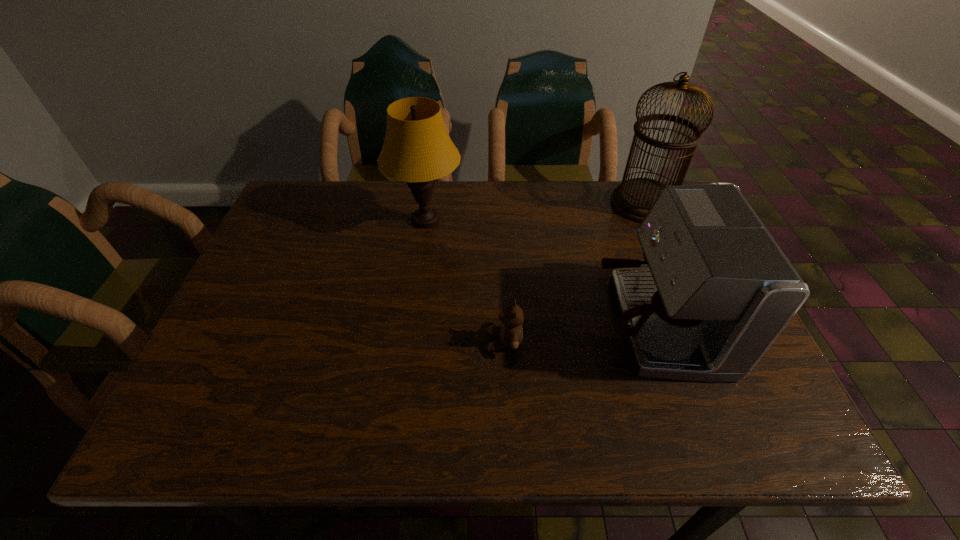
Where is `free space located 0.080m on the front of the second shortest object near the spout`? This screenshot has width=960, height=540. free space located 0.080m on the front of the second shortest object near the spout is located at coordinates (559, 323).

I want to click on vacant space situated 0.210m on the front of the second shortest object near the spout, so click(500, 323).

Locate an element on the screen. vacant space positioned on the front-facing side of the shortest object is located at coordinates (310, 341).

Find the location of a particular element. The image size is (960, 540). vacant space located on the front-facing side of the shortest object is located at coordinates (343, 341).

Where is `vacant space located on the front-facing side of the shortest object`? This screenshot has width=960, height=540. vacant space located on the front-facing side of the shortest object is located at coordinates (356, 341).

Locate an element on the screen. The image size is (960, 540). birdcage present at the far edge is located at coordinates (633, 198).

Where is `lampshade that is positioned at the far edge`? This screenshot has height=540, width=960. lampshade that is positioned at the far edge is located at coordinates (417, 149).

At what (x,y) coordinates should I click in order to perform the action: click on birdcage that is at the right edge. Please return your answer as a coordinate pair (x, y). The image size is (960, 540). Looking at the image, I should click on click(633, 198).

Image resolution: width=960 pixels, height=540 pixels. I want to click on coffee maker at the right edge, so click(x=719, y=290).

This screenshot has width=960, height=540. Identify the location of object that is at the far right corner. (633, 198).